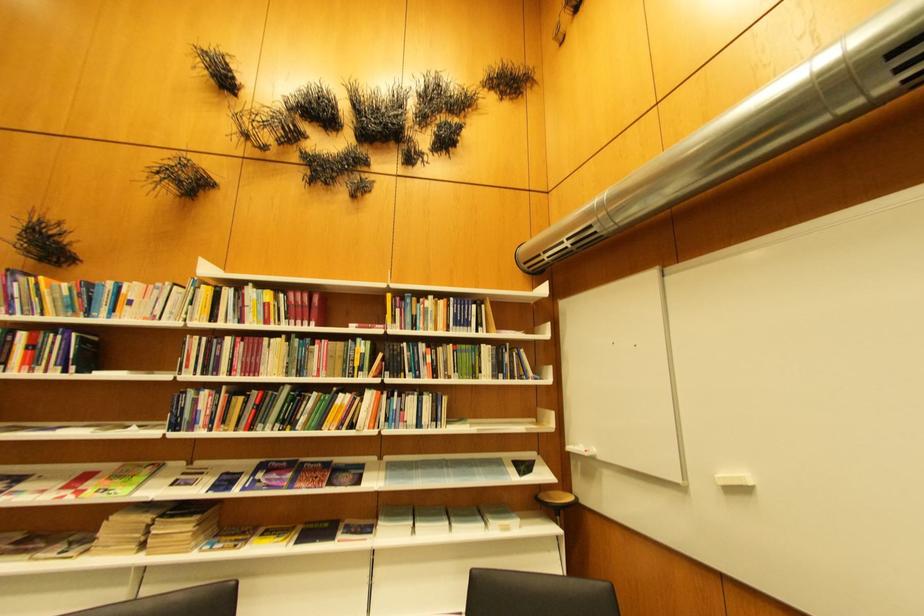
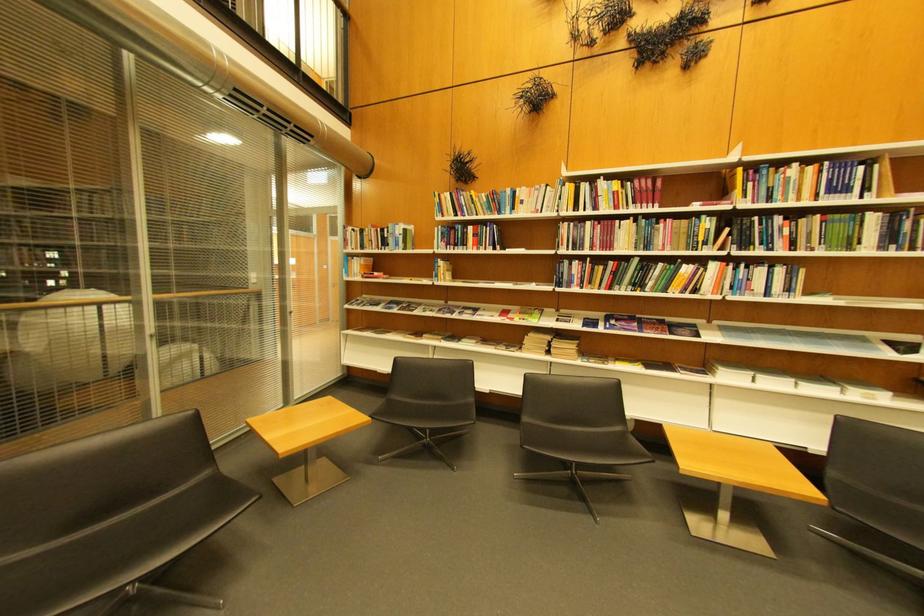
The point at (238, 341) is marked in the first image. Where is the corresponding point in the second image?

(600, 225)